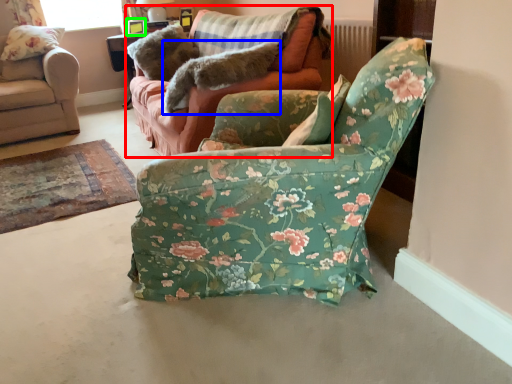
Question: Which is farther away from studio couch (highlighted by a red box)? animal (highlighted by a blue box) or picture frame (highlighted by a green box)?

Choices:
 (A) animal
 (B) picture frame

Answer: (B)